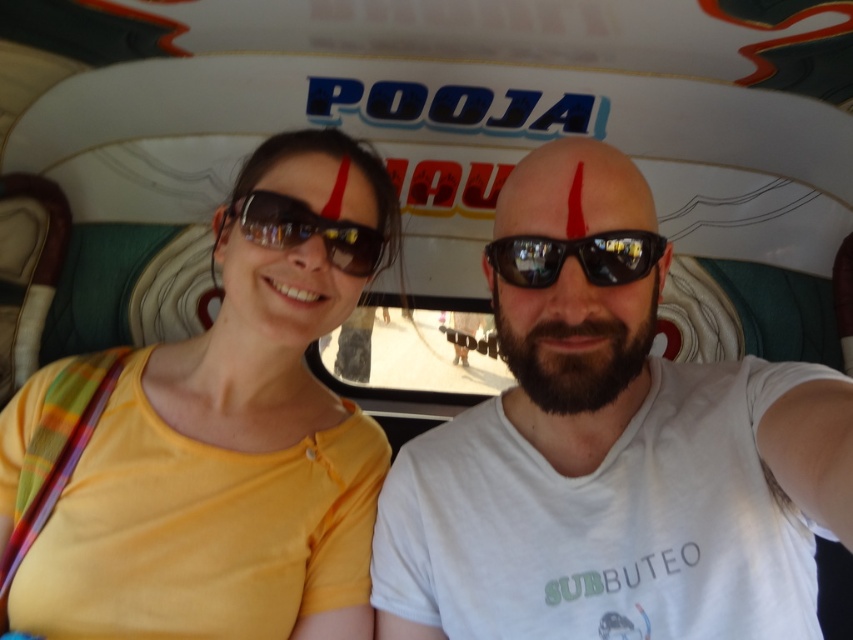
Question: Is white matte t-shirt at center above yellow matte shirt at upper left?

Choices:
 (A) yes
 (B) no

Answer: (B)

Question: Can you confirm if yellow matte shirt at upper left is bigger than matte yellow shirt at center?

Choices:
 (A) yes
 (B) no

Answer: (A)

Question: Which of the following is the farthest from the observer?

Choices:
 (A) yellow matte shirt at upper left
 (B) white matte t-shirt at center
 (C) matte yellow shirt at center
 (D) red matte forehead at center

Answer: (C)

Question: Which point is farther to the camera?

Choices:
 (A) yellow matte shirt at upper left
 (B) black matte sunglasses at center

Answer: (A)

Question: Which is farther from the matte black goggles at center?

Choices:
 (A) black matte sunglasses at center
 (B) white matte t-shirt at center

Answer: (B)

Question: Is black reflective sunglasses at center positioned in front of matte black goggles at center?

Choices:
 (A) no
 (B) yes

Answer: (B)